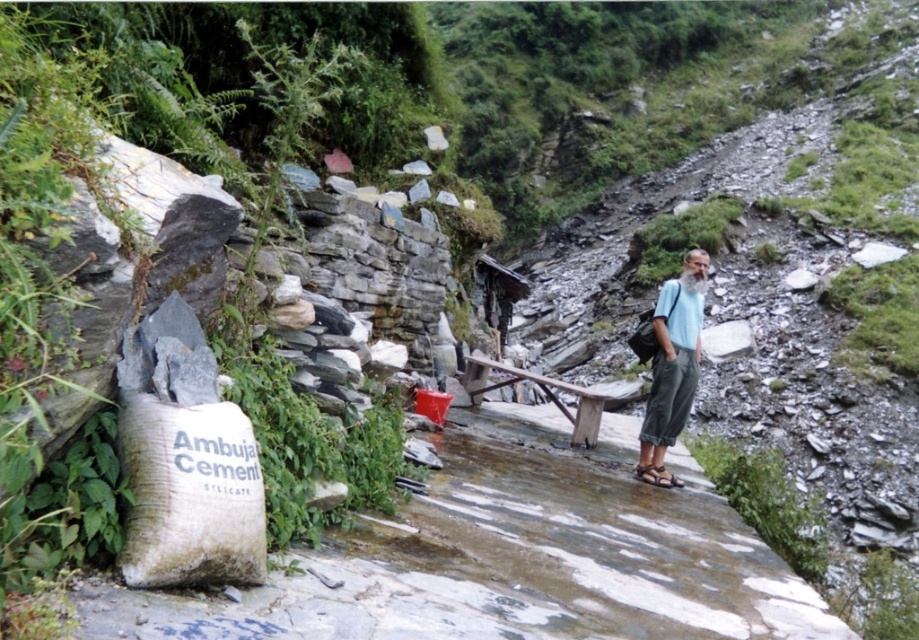
Can you confirm if white stone path at center is positioned above light blue fabric shirt at right?

No.

Does point (617, 608) lie behind point (694, 264)?

That is False.

Is point (429, 544) positioned before point (679, 288)?

That is True.

Identify the location of white stone path at center. The height and width of the screenshot is (640, 919). (508, 557).